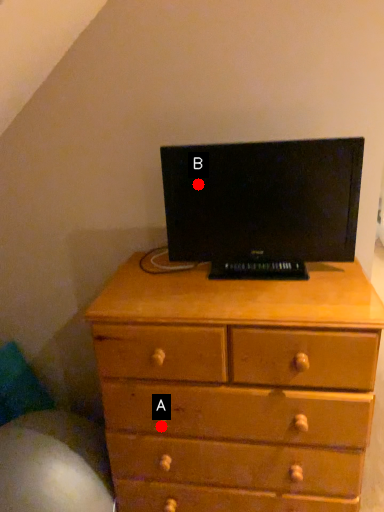
Question: Two points are circled on the image, labeled by A and B beside each circle. Which point is closer to the camera?

Choices:
 (A) A is closer
 (B) B is closer

Answer: (A)